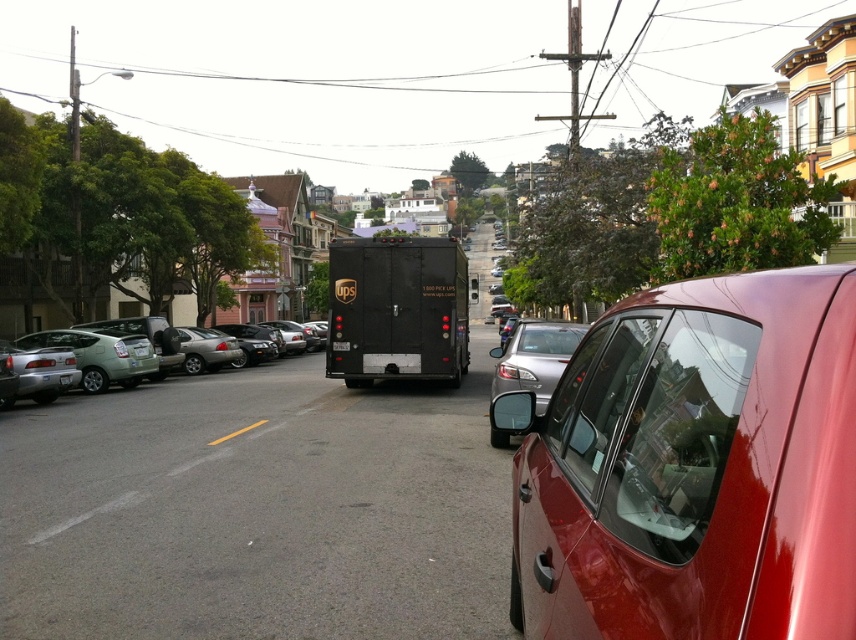
You are a delivery driver trying to park your vehicle between the glossy red car at right and the satin silver sedan at center. Your vehicle is 1.8 meters wide. Can you fit your vehicle between them?

The glossy red car at right is thinner than the satin silver sedan at center, so the space between them may be sufficient. However, without knowing the exact distance between the cars, it is impossible to determine if your vehicle will fit. Please check the available space carefully before attempting to park.

Based on the photo, you are a delivery driver who needs to park your vehicle between the satin silver sedan at center and the black matte license plate at center. Your vehicle is 15 feet long. Is there enough space between them for your vehicle?

The satin silver sedan at center is 36.87 feet from the black matte license plate at center. Since your vehicle is 15 feet long, there is sufficient space between them for parking.